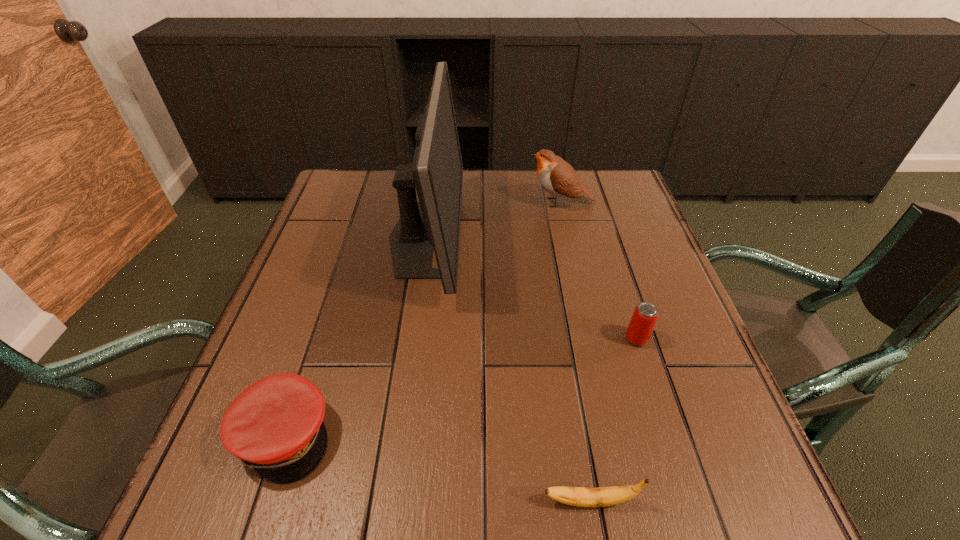
What are the coordinates of `vacant space that's between the beer can and the tallest object` in the screenshot? It's located at (531, 288).

You are a GUI agent. You are given a task and a screenshot of the screen. Output one action in this format:
    pyautogui.click(x=<x>, y=<y>)
    Task: Click on the object that ranks as the second closest to the banana
    The width and height of the screenshot is (960, 540).
    Given the screenshot: What is the action you would take?
    pyautogui.click(x=275, y=426)

The image size is (960, 540). In order to click on object that can be found as the closest to the beer can in this screenshot , I will do `click(576, 496)`.

Find the location of a particular element. free space in the image that satisfies the following two spatial constraints: 1. on the front side of the beer can; 2. on the peel of the banana from the top is located at coordinates (688, 501).

At what (x,y) coordinates should I click in order to perform the action: click on vacant space that satisfies the following two spatial constraints: 1. on the screen side of the fourth object from right to left; 2. on the back side of the beer can. Please return your answer as a coordinate pair (x, y). Image resolution: width=960 pixels, height=540 pixels. Looking at the image, I should click on (411, 339).

This screenshot has width=960, height=540. Find the location of `free space in the image that satisfies the following two spatial constraints: 1. on the screen side of the beer can; 2. on the left side of the tallest object`. free space in the image that satisfies the following two spatial constraints: 1. on the screen side of the beer can; 2. on the left side of the tallest object is located at coordinates (411, 339).